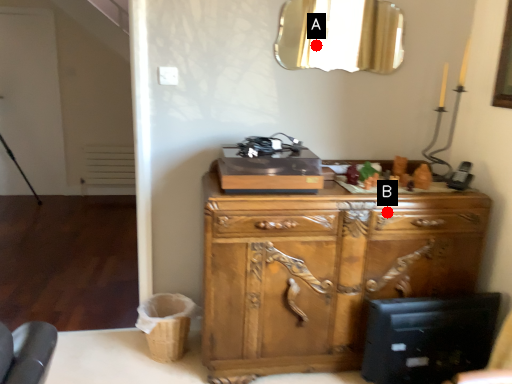
Question: Two points are circled on the image, labeled by A and B beside each circle. Which point is farther from the camera taking this photo?

Choices:
 (A) A is further
 (B) B is further

Answer: (A)